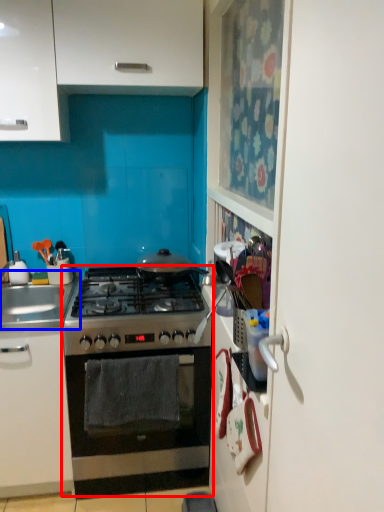
Question: Which of the following is the farthest to the observer, oven (highlighted by a red box) or sink (highlighted by a blue box)?

Choices:
 (A) oven
 (B) sink

Answer: (B)